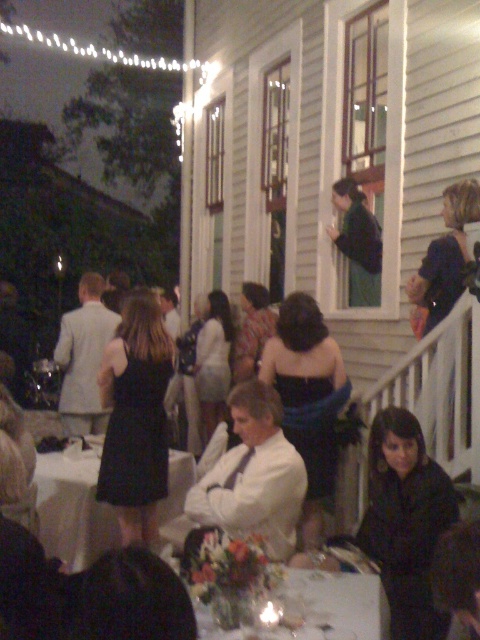
Who is shorter, black satin dress at center or white glossy table at lower center?

With less height is white glossy table at lower center.

The width and height of the screenshot is (480, 640). In order to click on black satin dress at center in this screenshot , I will do `click(135, 419)`.

Find the location of a particular element. black satin dress at center is located at coordinates (135, 419).

Can you confirm if white satin shirt at center is taller than white glossy table at lower center?

Yes, white satin shirt at center is taller than white glossy table at lower center.

Between point (262, 406) and point (294, 602), which one is positioned behind?

Point (262, 406)

I want to click on white satin shirt at center, so click(x=253, y=476).

Identify the location of white satin shirt at center. (253, 476).

Does black matte dress at lower right have a lesser width compared to white tablecloth at center?

Indeed, black matte dress at lower right has a lesser width compared to white tablecloth at center.

From the picture: Can you confirm if black matte dress at lower right is positioned below white tablecloth at center?

Indeed, black matte dress at lower right is positioned under white tablecloth at center.

Image resolution: width=480 pixels, height=640 pixels. Identify the location of black matte dress at lower right. (406, 522).